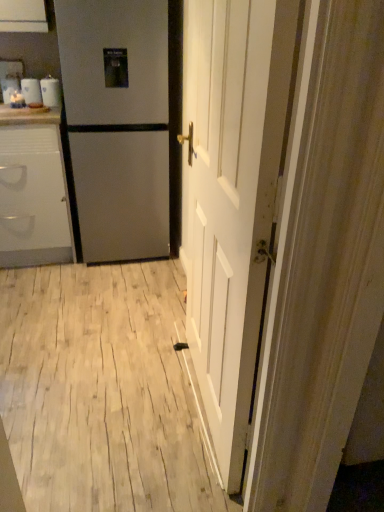
Question: Is satin silver refrigerator at left at the left side of white glossy mugs at upper left?

Choices:
 (A) no
 (B) yes

Answer: (A)

Question: Considering the relative sizes of satin silver refrigerator at left and white glossy mugs at upper left in the image provided, is satin silver refrigerator at left taller than white glossy mugs at upper left?

Choices:
 (A) no
 (B) yes

Answer: (B)

Question: Is satin silver refrigerator at left thinner than white glossy mugs at upper left?

Choices:
 (A) yes
 (B) no

Answer: (B)

Question: Is satin silver refrigerator at left further to the viewer compared to white glossy mugs at upper left?

Choices:
 (A) no
 (B) yes

Answer: (A)

Question: Is satin silver refrigerator at left in front of white glossy mugs at upper left?

Choices:
 (A) yes
 (B) no

Answer: (A)

Question: In terms of width, does white wooden door at center look wider or thinner when compared to white glossy counter top at upper left?

Choices:
 (A) thin
 (B) wide

Answer: (A)

Question: In the image, is white wooden door at center positioned in front of or behind white glossy counter top at upper left?

Choices:
 (A) front
 (B) behind

Answer: (A)

Question: Considering the positions of point (266, 193) and point (39, 116), is point (266, 193) closer or farther from the camera than point (39, 116)?

Choices:
 (A) closer
 (B) farther

Answer: (A)

Question: From a real-world perspective, relative to white glossy counter top at upper left, is white wooden door at center vertically above or below?

Choices:
 (A) below
 (B) above

Answer: (A)

Question: Based on their positions, is white glossy cabinet at left located to the left or right of white glossy counter top at upper left?

Choices:
 (A) right
 (B) left

Answer: (B)

Question: In terms of size, does white glossy cabinet at left appear bigger or smaller than white glossy counter top at upper left?

Choices:
 (A) big
 (B) small

Answer: (A)

Question: Does point (34, 113) appear closer or farther from the camera than point (43, 117)?

Choices:
 (A) farther
 (B) closer

Answer: (B)

Question: Is white glossy cabinet at left in front of or behind white glossy counter top at upper left in the image?

Choices:
 (A) front
 (B) behind

Answer: (A)

Question: Is white glossy mugs at upper left taller or shorter than white wood floor at center?

Choices:
 (A) tall
 (B) short

Answer: (A)

Question: From a real-world perspective, relative to white wood floor at center, is white glossy mugs at upper left vertically above or below?

Choices:
 (A) below
 (B) above

Answer: (B)